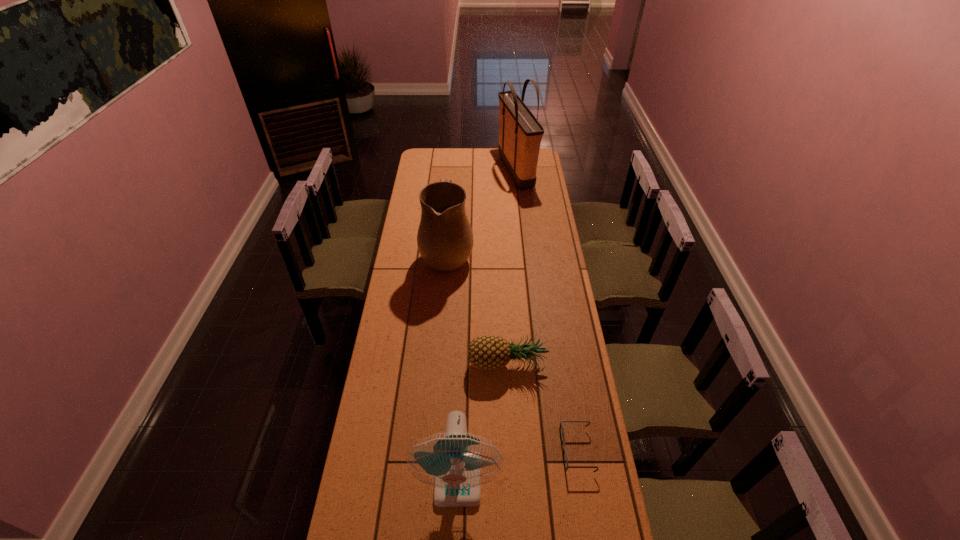
You are a GUI agent. You are given a task and a screenshot of the screen. Output one action in this format:
    pyautogui.click(x=<x>, y=<y>)
    Task: Click on the farthest object
    Image resolution: width=960 pixels, height=540 pixels.
    Given the screenshot: What is the action you would take?
    pyautogui.click(x=520, y=134)

Identify the location of shopping bag. The width and height of the screenshot is (960, 540). (520, 134).

Where is `the fourth nearest object`? This screenshot has width=960, height=540. the fourth nearest object is located at coordinates (445, 241).

Image resolution: width=960 pixels, height=540 pixels. What are the coordinates of `fan` in the screenshot? It's located at (456, 463).

Where is `the third nearest object`? the third nearest object is located at coordinates (485, 352).

Image resolution: width=960 pixels, height=540 pixels. Identify the location of pineapple. (485, 352).

This screenshot has height=540, width=960. Find the location of `the shortest object`. the shortest object is located at coordinates (561, 424).

Where is `free space located 0.290m on the front of the shopping bag`? The height and width of the screenshot is (540, 960). free space located 0.290m on the front of the shopping bag is located at coordinates (522, 228).

Locate an element on the screen. vacant space located 0.390m at the spout of the fourth nearest object is located at coordinates (553, 254).

Find the location of a particular element. free spot located 0.240m on the front of the fourth tallest object is located at coordinates (511, 443).